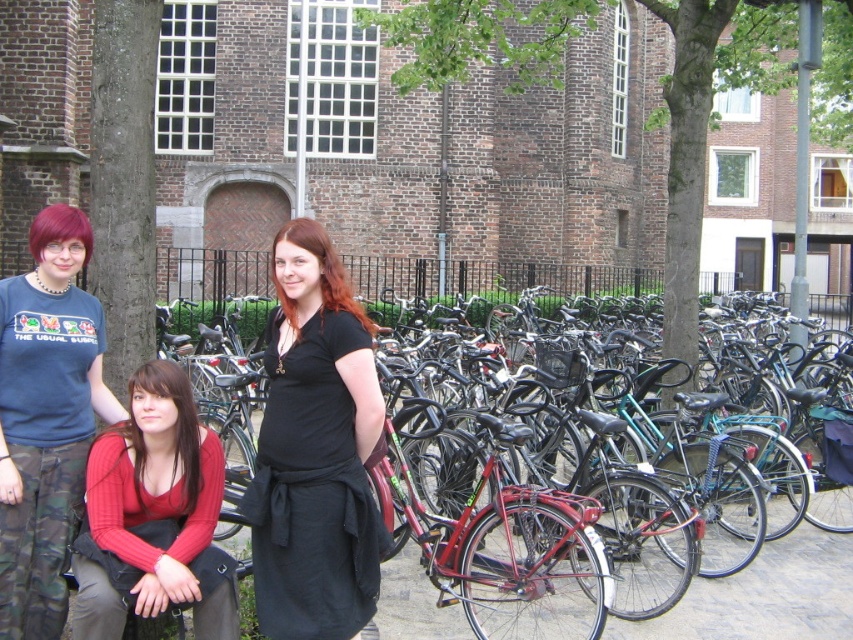
Identify the location of camouflage pants at left. (45, 419).

How distant is camouflage pants at left from brown rough bark at left?

The distance of camouflage pants at left from brown rough bark at left is 3.36 meters.

The height and width of the screenshot is (640, 853). Find the location of `camouflage pants at left`. camouflage pants at left is located at coordinates (45, 419).

In the scene shown: Who is positioned more to the left, green leafy tree at center or camouflage pants at left?

Positioned to the left is camouflage pants at left.

Between green leafy tree at center and camouflage pants at left, which one has more height?

green leafy tree at center is taller.

Between point (477, 0) and point (51, 496), which one is positioned in front?

Point (51, 496)

Identify the location of green leafy tree at center. (717, 115).

Can you confirm if green leafy tree at center is positioned below knitted red sweater at lower left?

No, green leafy tree at center is not below knitted red sweater at lower left.

Is green leafy tree at center wider than knitted red sweater at lower left?

Yes.

You are a GUI agent. You are given a task and a screenshot of the screen. Output one action in this format:
    pyautogui.click(x=<x>, y=<y>)
    Task: Click on the green leafy tree at center
    This screenshot has width=853, height=640.
    Given the screenshot: What is the action you would take?
    pyautogui.click(x=717, y=115)

Image resolution: width=853 pixels, height=640 pixels. I want to click on green leafy tree at center, so click(717, 115).